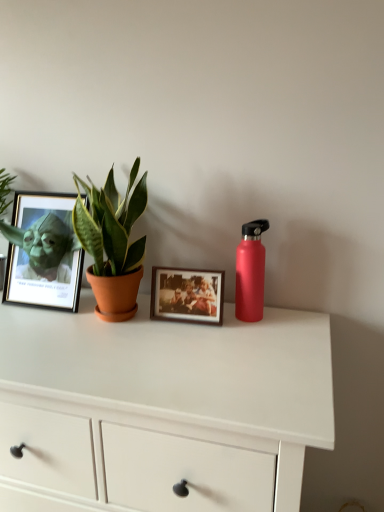
What do you see at coordinates (112, 243) in the screenshot?
I see `green matte plant at left` at bounding box center [112, 243].

Image resolution: width=384 pixels, height=512 pixels. I want to click on wooden photo frame at center, acting as the 1th picture frame starting from the right, so click(x=187, y=295).

Locate an element on the screen. This screenshot has width=384, height=512. white matte chest of drawers at center is located at coordinates (160, 409).

Would you say wooden photo frame at center, which ranks as the 2th picture frame in left-to-right order, is inside or outside matte black frame at left, the second picture frame in the right-to-left sequence?

wooden photo frame at center, which ranks as the 2th picture frame in left-to-right order, is spatially situated outside matte black frame at left, the second picture frame in the right-to-left sequence.

Which of these two, wooden photo frame at center, which ranks as the 2th picture frame in left-to-right order, or matte black frame at left, which is the 1th picture frame from left to right, is bigger?

matte black frame at left, which is the 1th picture frame from left to right, is bigger.

Which of these two, wooden photo frame at center, acting as the 1th picture frame starting from the right, or matte black frame at left, the second picture frame in the right-to-left sequence, stands taller?

matte black frame at left, the second picture frame in the right-to-left sequence, is taller.

How far apart are wooden photo frame at center, acting as the 1th picture frame starting from the right, and matte black frame at left, which is the 1th picture frame from left to right?

wooden photo frame at center, acting as the 1th picture frame starting from the right, and matte black frame at left, which is the 1th picture frame from left to right, are 12.66 inches apart.

From the image's perspective, is matte red water bottle at right under green matte plant at left?

Yes, from the image's perspective, matte red water bottle at right is beneath green matte plant at left.

Which object is further away from the camera, matte red water bottle at right or green matte plant at left?

matte red water bottle at right is more distant.

Is point (264, 271) positioned before point (138, 245)?

That is False.

I want to click on bottle behind the green matte plant at left, so click(x=250, y=272).

Based on the photo, considering the relative sizes of green matte plant at left and matte red water bottle at right in the image provided, is green matte plant at left taller than matte red water bottle at right?

Yes.

Considering the positions of objects green matte plant at left and matte red water bottle at right in the image provided, who is more to the right, green matte plant at left or matte red water bottle at right?

→ matte red water bottle at right is more to the right.

Between green matte plant at left and matte red water bottle at right, which one has larger width?

green matte plant at left.

From the image's perspective, does green matte plant at left appear higher than matte red water bottle at right?

Indeed, from the image's perspective, green matte plant at left is shown above matte red water bottle at right.

Who is shorter, white matte chest of drawers at center or matte red water bottle at right?

matte red water bottle at right is shorter.

From the image's perspective, is white matte chest of drawers at center positioned above or below matte red water bottle at right?

white matte chest of drawers at center is situated lower than matte red water bottle at right in the image.

Looking at this image, would you say matte red water bottle at right is part of white matte chest of drawers at center's contents?

No, matte red water bottle at right is located outside of white matte chest of drawers at center.

Between white matte chest of drawers at center and matte red water bottle at right, which one has smaller size?

Smaller between the two is matte red water bottle at right.

Is matte black frame at left, which is the 1th picture frame from left to right, in contact with green matte plant at left?

No, matte black frame at left, which is the 1th picture frame from left to right, is not with green matte plant at left.

Considering the points (70, 212) and (139, 272), which point is in front, point (70, 212) or point (139, 272)?

Positioned in front is point (139, 272).

Does matte black frame at left, the second picture frame in the right-to-left sequence, come in front of green matte plant at left?

No, it is behind green matte plant at left.

Which of these two, matte black frame at left, which is the 1th picture frame from left to right, or green matte plant at left, is bigger?

green matte plant at left is bigger.

Which object is more forward, white matte chest of drawers at center or green matte plant at left?

white matte chest of drawers at center is more forward.

Consider the image. Can we say white matte chest of drawers at center lies outside green matte plant at left?

Yes, white matte chest of drawers at center is located beyond the bounds of green matte plant at left.

Can you confirm if white matte chest of drawers at center is bigger than green matte plant at left?

Yes.

From the image's perspective, is white matte chest of drawers at center located above or below green matte plant at left?

Based on their image positions, white matte chest of drawers at center is located beneath green matte plant at left.

The height and width of the screenshot is (512, 384). There is a white matte chest of drawers at center. In order to click on the 1st picture frame above it (from a real-world perspective) in this screenshot , I will do `click(187, 295)`.

Which object is further away from the camera taking this photo, wooden photo frame at center, which ranks as the 2th picture frame in left-to-right order, or white matte chest of drawers at center?

wooden photo frame at center, which ranks as the 2th picture frame in left-to-right order.

Considering the relative positions of wooden photo frame at center, which ranks as the 2th picture frame in left-to-right order, and white matte chest of drawers at center in the image provided, is wooden photo frame at center, which ranks as the 2th picture frame in left-to-right order, to the right of white matte chest of drawers at center from the viewer's perspective?

Indeed, wooden photo frame at center, which ranks as the 2th picture frame in left-to-right order, is positioned on the right side of white matte chest of drawers at center.

How many degrees apart are the facing directions of wooden photo frame at center, acting as the 1th picture frame starting from the right, and white matte chest of drawers at center?

3.19 degrees separate the facing orientations of wooden photo frame at center, acting as the 1th picture frame starting from the right, and white matte chest of drawers at center.

The width and height of the screenshot is (384, 512). I want to click on picture frame that appears below the matte black frame at left, which is the 1th picture frame from left to right (from a real-world perspective), so click(x=187, y=295).

At what (x,y) coordinates should I click in order to perform the action: click on houseplant in front of the matte red water bottle at right. Please return your answer as a coordinate pair (x, y). This screenshot has height=512, width=384. Looking at the image, I should click on (112, 243).

Based on their spatial positions, is green matte plant at left or wooden photo frame at center, acting as the 1th picture frame starting from the right, further from matte red water bottle at right?

The object further to matte red water bottle at right is green matte plant at left.

Estimate the real-world distances between objects in this image. Which object is further from matte red water bottle at right, wooden photo frame at center, which ranks as the 2th picture frame in left-to-right order, or green matte plant at left?

Among the two, green matte plant at left is located further to matte red water bottle at right.

Which object lies further to the anchor point wooden photo frame at center, acting as the 1th picture frame starting from the right, matte black frame at left, which is the 1th picture frame from left to right, or green matte plant at left?

The object further to wooden photo frame at center, acting as the 1th picture frame starting from the right, is matte black frame at left, which is the 1th picture frame from left to right.

Based on their spatial positions, is green matte plant at left or matte black frame at left, the second picture frame in the right-to-left sequence, further from wooden photo frame at center, acting as the 1th picture frame starting from the right?

Among the two, matte black frame at left, the second picture frame in the right-to-left sequence, is located further to wooden photo frame at center, acting as the 1th picture frame starting from the right.

When comparing their distances from green matte plant at left, does wooden photo frame at center, acting as the 1th picture frame starting from the right, or matte black frame at left, the second picture frame in the right-to-left sequence, seem closer?

wooden photo frame at center, acting as the 1th picture frame starting from the right, lies closer to green matte plant at left than the other object.

Estimate the real-world distances between objects in this image. Which object is further from green matte plant at left, matte black frame at left, the second picture frame in the right-to-left sequence, or white matte chest of drawers at center?

white matte chest of drawers at center.

Estimate the real-world distances between objects in this image. Which object is further from white matte chest of drawers at center, green matte plant at left or matte red water bottle at right?

Among the two, matte red water bottle at right is located further to white matte chest of drawers at center.

Based on their spatial positions, is matte black frame at left, the second picture frame in the right-to-left sequence, or wooden photo frame at center, acting as the 1th picture frame starting from the right, further from white matte chest of drawers at center?

Based on the image, matte black frame at left, the second picture frame in the right-to-left sequence, appears to be further to white matte chest of drawers at center.

The height and width of the screenshot is (512, 384). Find the location of `bottle between matte black frame at left, the second picture frame in the right-to-left sequence, and white matte chest of drawers at center, in the vertical direction`. bottle between matte black frame at left, the second picture frame in the right-to-left sequence, and white matte chest of drawers at center, in the vertical direction is located at coordinates (250, 272).

Find the location of `bottle between green matte plant at left and white matte chest of drawers at center in the up-down direction`. bottle between green matte plant at left and white matte chest of drawers at center in the up-down direction is located at coordinates (250, 272).

In order to click on picture frame between matte black frame at left, which is the 1th picture frame from left to right, and white matte chest of drawers at center in the up-down direction in this screenshot , I will do `click(187, 295)`.

At what (x,y) coordinates should I click in order to perform the action: click on picture frame between green matte plant at left and matte red water bottle at right from left to right. Please return your answer as a coordinate pair (x, y). Looking at the image, I should click on (187, 295).